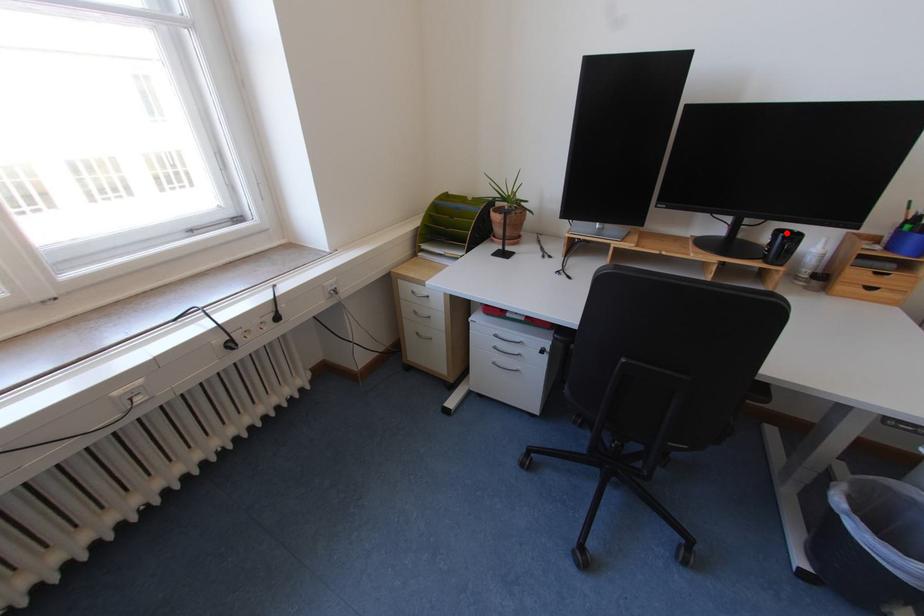
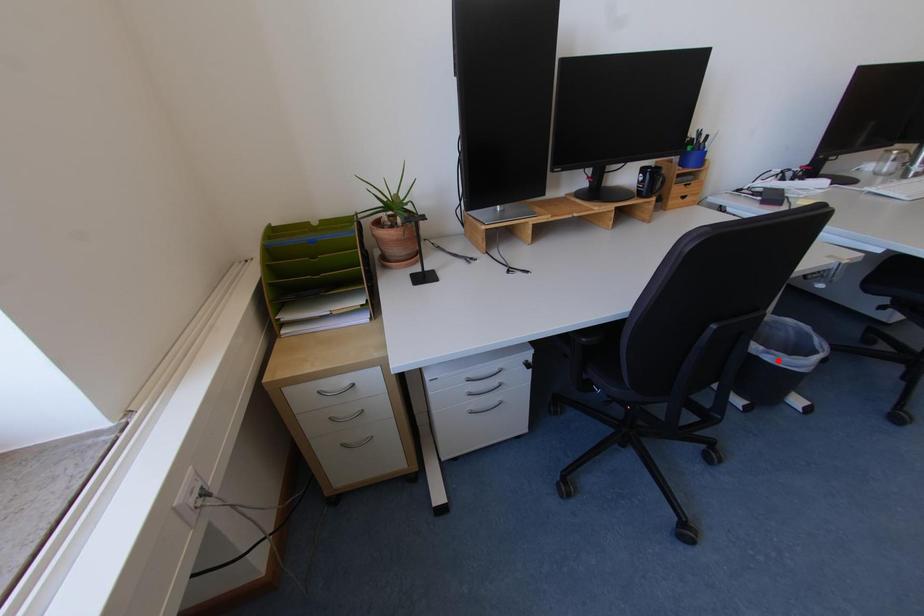
I am providing you with two images of the same scene from different viewpoints. A red point is marked on the first image and another point is marked on the second image. Do the highlighted points in image1 and image2 indicate the same real-world spot?

No